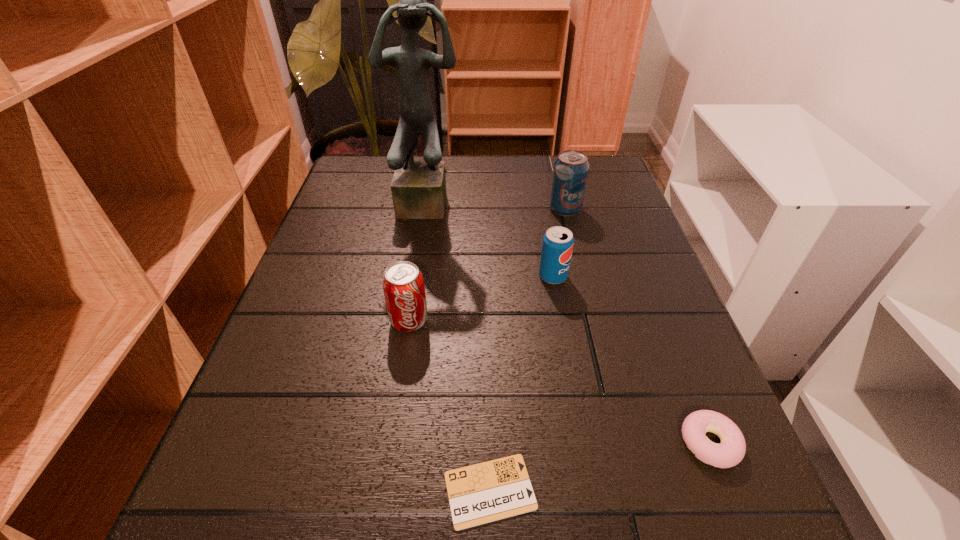
You are a GUI agent. You are given a task and a screenshot of the screen. Output one action in this format:
    pyautogui.click(x=<x>, y=<y>)
    Task: Click on the tallest object
    This screenshot has width=960, height=540.
    Given the screenshot: What is the action you would take?
    pyautogui.click(x=418, y=188)

The height and width of the screenshot is (540, 960). I want to click on the farthest soda can, so click(x=570, y=173).

Locate an element on the screen. Image resolution: width=960 pixels, height=540 pixels. the leftmost soda can is located at coordinates [x=403, y=285].

Locate an element on the screen. The image size is (960, 540). the fourth farthest object is located at coordinates (403, 285).

Where is `the second nearest soda can`? The height and width of the screenshot is (540, 960). the second nearest soda can is located at coordinates (557, 246).

Where is `the fifth tallest object`? The width and height of the screenshot is (960, 540). the fifth tallest object is located at coordinates (731, 450).

The width and height of the screenshot is (960, 540). I want to click on the rightmost object, so pos(731,450).

Identify the location of identity card. (497, 489).

This screenshot has height=540, width=960. I want to click on vacant point located 0.310m on the face of the sculpture, so click(x=411, y=323).

Identify the location of free location located 0.220m on the front of the farthest soda can. Image resolution: width=960 pixels, height=540 pixels. (584, 285).